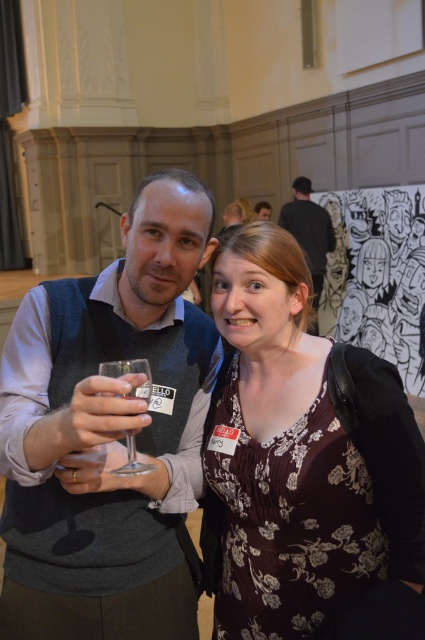
You are a photographer setting up for a group photo. You notice the matte floral dress at center and the clear glass wine glass at center. Which object is positioned higher in the frame?

The matte floral dress at center is taller than the clear glass wine glass at center, so the matte floral dress at center is positioned higher in the frame.

You are at a formal event and want to pick up your drink without touching the matte floral dress at center. Is the clear glass wine glass at center within reach?

The clear glass wine glass at center is positioned above the matte floral dress at center, so it is within reach without touching the dress.

What is the object located at the coordinate point [299,456] in the image?

The object located at the coordinate point [299,456] is the matte floral dress at center.